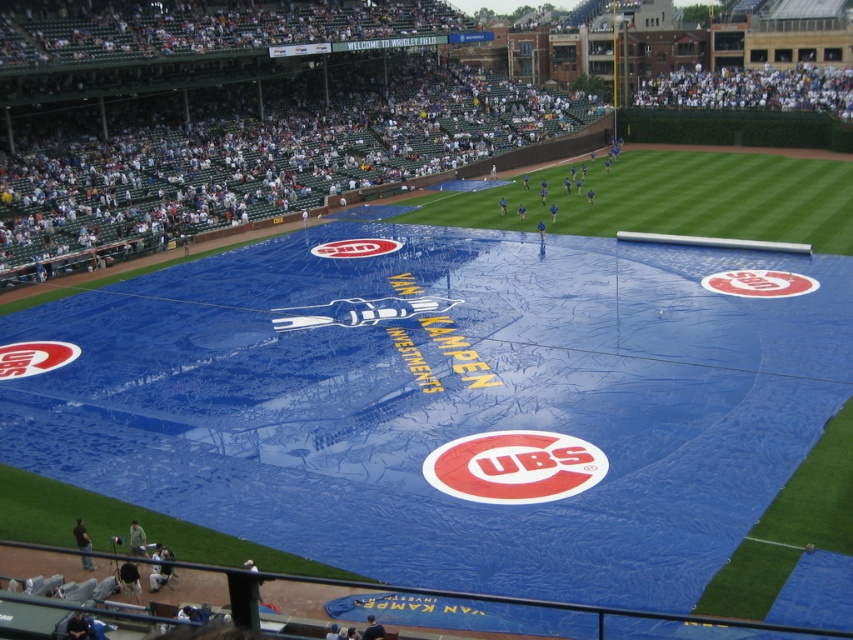
Can you confirm if red matte logo at center is bigger than matte red circle at center?

Indeed, red matte logo at center has a larger size compared to matte red circle at center.

Is point (569, 493) behind point (727, 275)?

No.

The height and width of the screenshot is (640, 853). Find the location of `red matte logo at center`. red matte logo at center is located at coordinates (514, 467).

In the scene shown: Can you confirm if red matte logo at center is thinner than matte white logo at center?

Yes.

Which is behind, point (471, 451) or point (363, 252)?

Point (363, 252)

The width and height of the screenshot is (853, 640). What are the coordinates of `red matte logo at center` in the screenshot? It's located at (514, 467).

Which is in front, point (733, 278) or point (73, 348)?

Point (73, 348)

Which is more to the left, matte red circle at center or blue fabric tarp at center?

Positioned to the left is blue fabric tarp at center.

The image size is (853, 640). I want to click on matte red circle at center, so click(759, 284).